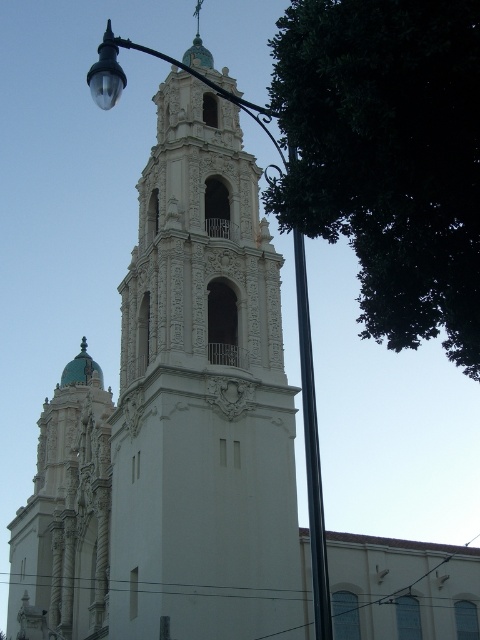
You are standing in front of the white stone tower at center and want to take a photo of it. There is a green leafy tree at upper right in your view. Will the tree appear closer to you or farther away in the photo compared to the tower?

The white stone tower at center is further to the viewer than the green leafy tree at upper right, so in the photo, the tree will appear farther away compared to the tower.

You are standing in front of the tower and notice both the white stone tower at center and the black metal pole at center. Which object would appear larger to someone looking at them from your position?

The white stone tower at center is bigger than the black metal pole at center, so it would appear larger to someone looking at them from your position.

You are standing in front of the tower and want to determine the relative positions of two points marked on the tower. The points are labeled as point 1 at coordinate (x=355, y=83) and point 2 at coordinate (x=303, y=353). From your vantage point, which point appears closer to you?

Point 1 at coordinate (x=355, y=83) is in front of point 2 at coordinate (x=303, y=353), so it appears closer to you.